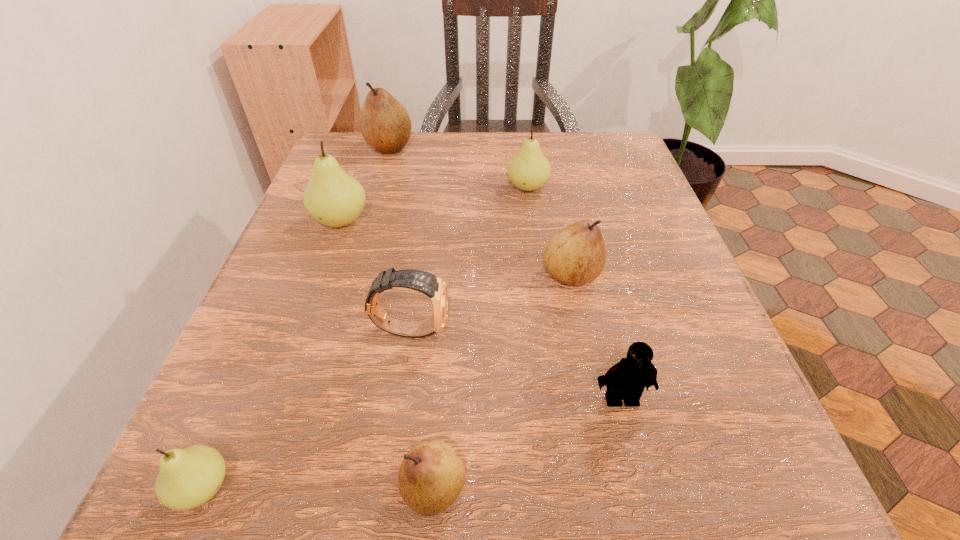
Find the location of a particular element. vacant space in between the Lego and the nearest green pear is located at coordinates (413, 443).

The height and width of the screenshot is (540, 960). I want to click on free space between the biggest brown pear and the Lego, so click(505, 273).

You are a GUI agent. You are given a task and a screenshot of the screen. Output one action in this format:
    pyautogui.click(x=<x>, y=<y>)
    Task: Click on the empty space that is in between the nearest green pear and the third farthest object
    The height and width of the screenshot is (540, 960).
    Given the screenshot: What is the action you would take?
    pyautogui.click(x=273, y=354)

At what (x,y) coordinates should I click in order to perform the action: click on free point between the second farthest object and the second farthest green pear. Please return your answer as a coordinate pair (x, y). Looking at the image, I should click on (434, 204).

I want to click on the seventh closest object to the third pear from right to left, so click(x=385, y=124).

Choose which object is the fourth nearest neighbor to the biggest green pear. Please provide its 2D coordinates. Your answer should be formatted as a tuple, i.e. [(x, y)], where the tuple contains the x and y coordinates of a point satisfying the conditions above.

[(576, 254)]

The height and width of the screenshot is (540, 960). In order to click on pear that is the fifth closest to the farthest green pear in this screenshot , I will do `click(187, 478)`.

Identify which pear is the third closest to the biggest brown pear. Please provide its 2D coordinates. Your answer should be formatted as a tuple, i.e. [(x, y)], where the tuple contains the x and y coordinates of a point satisfying the conditions above.

[(576, 254)]

Where is `brown pear that is the closest to the third farthest object`? The width and height of the screenshot is (960, 540). brown pear that is the closest to the third farthest object is located at coordinates (385, 124).

At what (x,y) coordinates should I click in order to perform the action: click on brown pear that can be found as the second closest to the farthest pear. Please return your answer as a coordinate pair (x, y). The image size is (960, 540). Looking at the image, I should click on (432, 475).